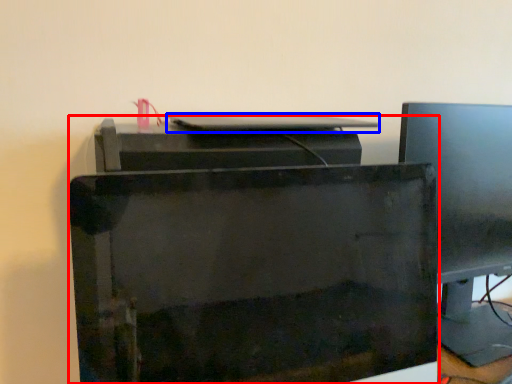
Question: Which of the following is the closest to the observer, printer (highlighted by a red box) or desktop (highlighted by a blue box)?

Choices:
 (A) printer
 (B) desktop

Answer: (A)